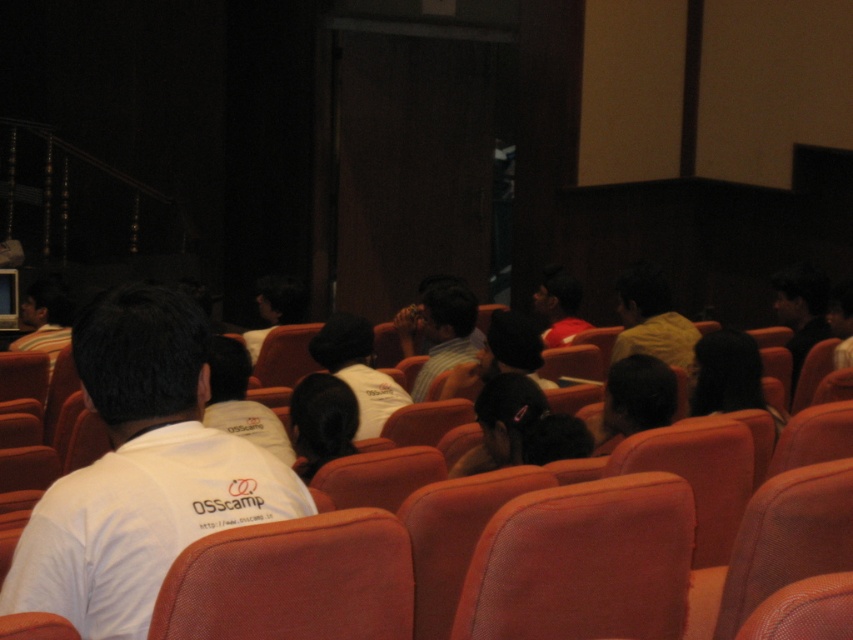
You are an event photographer at the back of the auditorium. You need to take a photo of the matte black shirt at upper right and the black fabric hair at center. Which object is closer to the camera?

The black fabric hair at center is below matte black shirt at upper right, so the matte black shirt at upper right is closer to the camera.

You are an event organizer checking the seating arrangement. You notice the black fabric hair at center and the matte black shirt at upper right. Which object is wider?

The matte black shirt at upper right is wider than the black fabric hair at center.

You are standing at the back of the auditorium and want to walk to the front. There is a person with black fabric hair at center in your way. What is the coordinate of the person blocking your path?

The person with black fabric hair at center is blocking your path and is located at coordinate point [729,376].